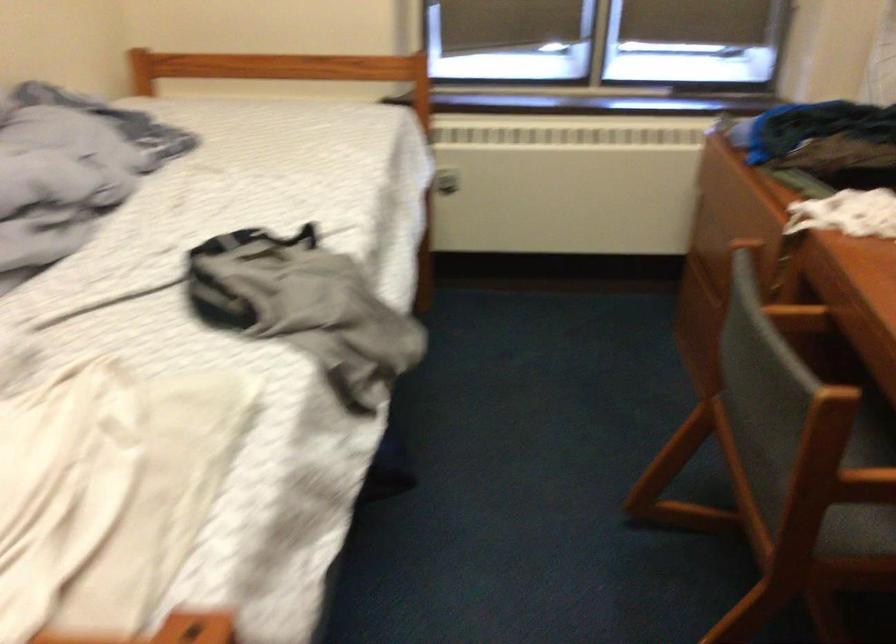
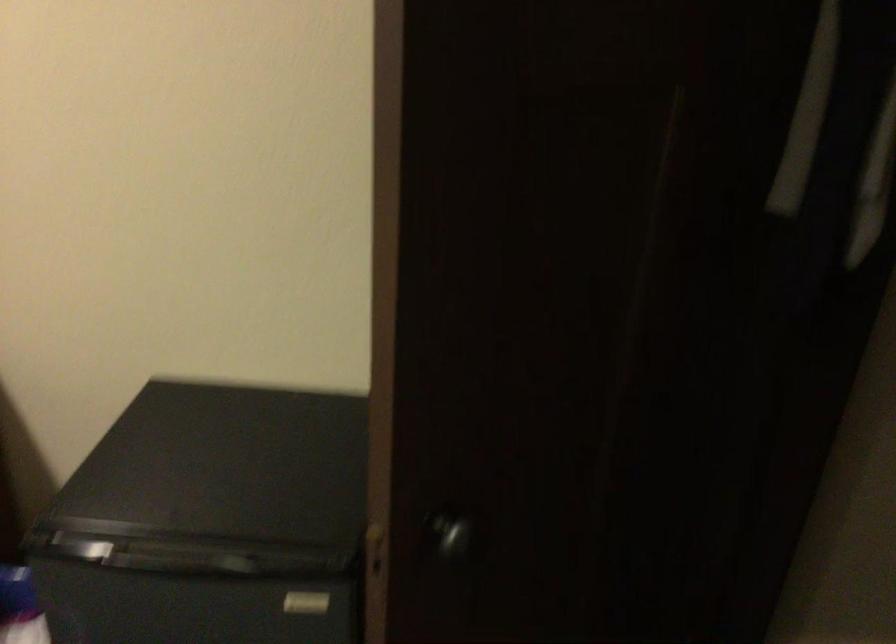
The images are taken continuously from a first-person perspective. In which direction is your viewpoint rotating?

The camera rotated toward right-down.